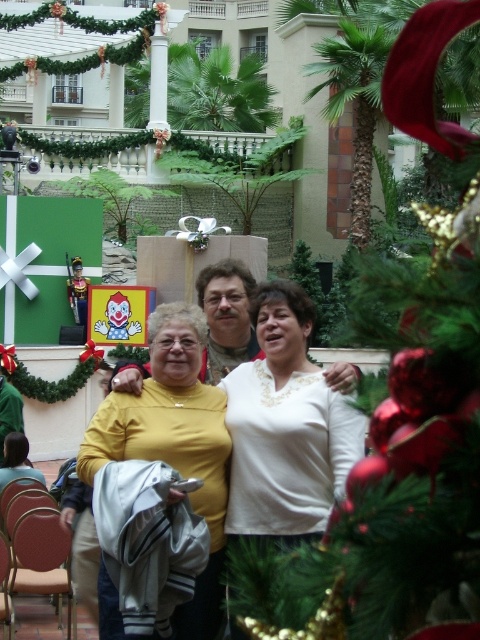
You are a photographer setting up for a group photo. You have two subjects wearing a white matte sweater at center and a yellow matte shirt at center. The distance between them is 2.08 meters. If you want to frame both subjects within a 3.5 meter wide backdrop, will they fit comfortably without needing to move closer?

The distance between the white matte sweater at center and the yellow matte shirt at center is 2.08 meters. Since the backdrop is 3.5 meters wide, there is enough space to comfortably frame both subjects without needing to move closer.

You are a photographer trying to decide which sweater to feature in your next shoot. Both the white matte sweater at center and the yellow knit sweater at center are in the scene. Which one is shorter?

The white matte sweater at center is shorter than the yellow knit sweater at center.